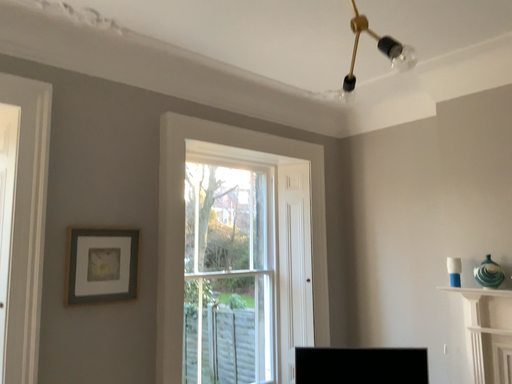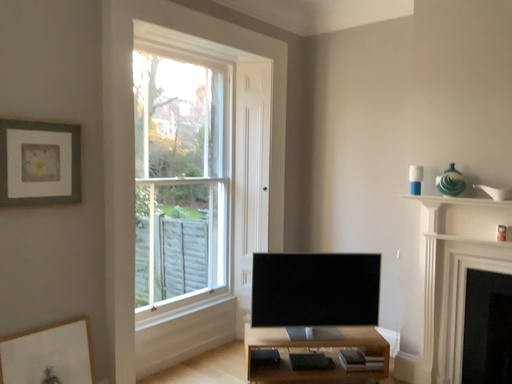
Question: How did the camera likely rotate when shooting the video?

Choices:
 (A) rotated upward
 (B) rotated downward

Answer: (B)